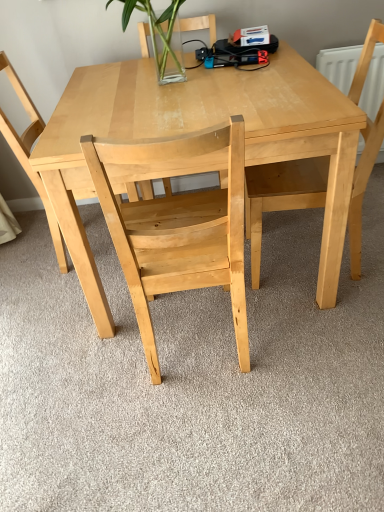
Question: Is natural wood chair at upper right, placed as the 3th chair when sorted from left to right, taller or shorter than natural wood table at center?

Choices:
 (A) tall
 (B) short

Answer: (A)

Question: From the image's perspective, relative to natural wood table at center, is natural wood chair at upper right, placed as the 3th chair when sorted from left to right, above or below?

Choices:
 (A) above
 (B) below

Answer: (A)

Question: Considering the real-world distances, which object is closest to the natural wood chair at upper right, placed as the 3th chair when sorted from left to right?

Choices:
 (A) natural wood table at center
 (B) natural wood chair at center, which appears as the first chair when viewed from the left
 (C) natural wood chair at center, positioned as the 2th chair in right-to-left order

Answer: (A)

Question: Estimate the real-world distances between objects in this image. Which object is closer to the natural wood chair at upper right, placed as the first chair when sorted from right to left?

Choices:
 (A) natural wood chair at center, the 3th chair viewed from the right
 (B) natural wood chair at center, the 2th chair viewed from the left
 (C) natural wood table at center

Answer: (C)